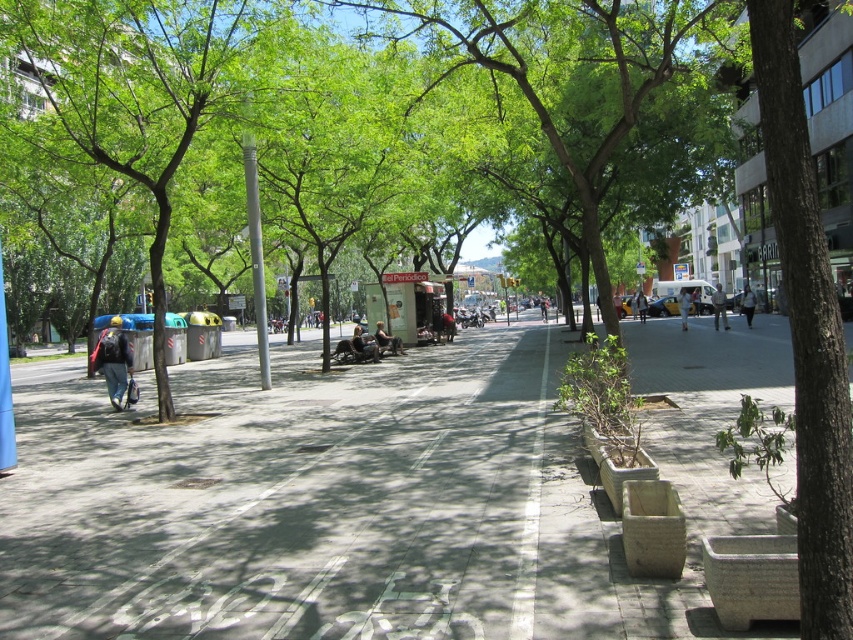
You are a delivery person with a cart that is 3 feet wide. You need to move from the gray concrete pavement at center to the green leafy tree at right. Is there enough space between them for your cart to pass through?

The distance between the gray concrete pavement at center and the green leafy tree at right is 27.86 feet, which is more than enough space for a 3 feet wide cart to pass through.

You are standing at the origin point in the park scene. The gray concrete pavement at center is located at a specific coordinate. Is it closer to the top or bottom of the image?

The gray concrete pavement at center is located at point 0.777 on the x axis and 0.437 on the y axis. Since the y coordinate is closer to 0.5, which is the center, it is closer to the bottom of the image if the origin is at the bottom left corner. However, without knowing the coordinate system, we can infer from the scene description that the pavement is at the center, so it is centrally located vertically.

Looking at this image, you are a delivery person with a cart that is 2 meters wide. You need to navigate through the park shown in the image. Can your cart fit through the space between the gray concrete pavement at center and the green leafy tree at right?

The gray concrete pavement at center is wider than the green leafy tree at right. Since the pavement is wider, the 2 meter wide cart should be able to fit through the space between them as long as the total width available is sufficient. However, without exact measurements, it is recommended to check the actual space before proceeding.